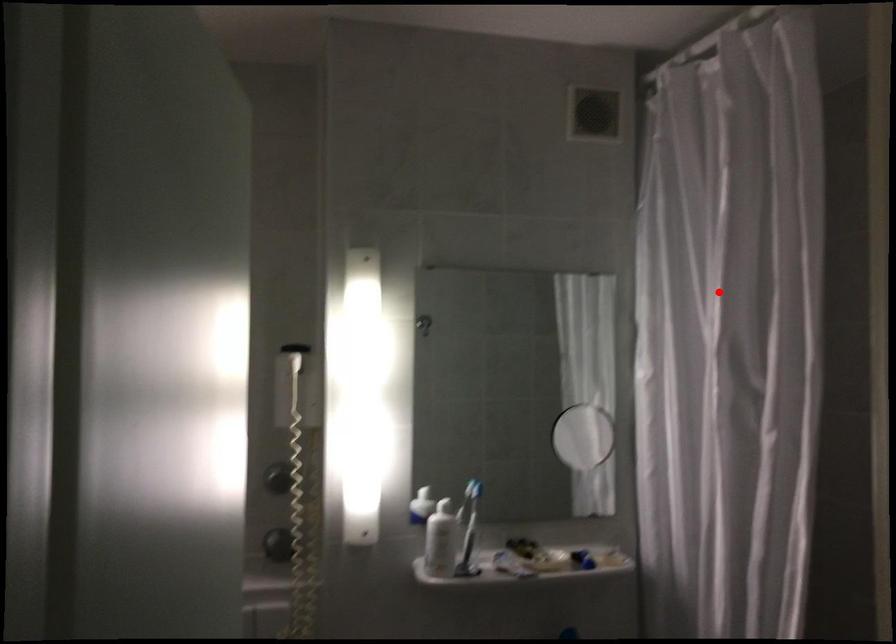
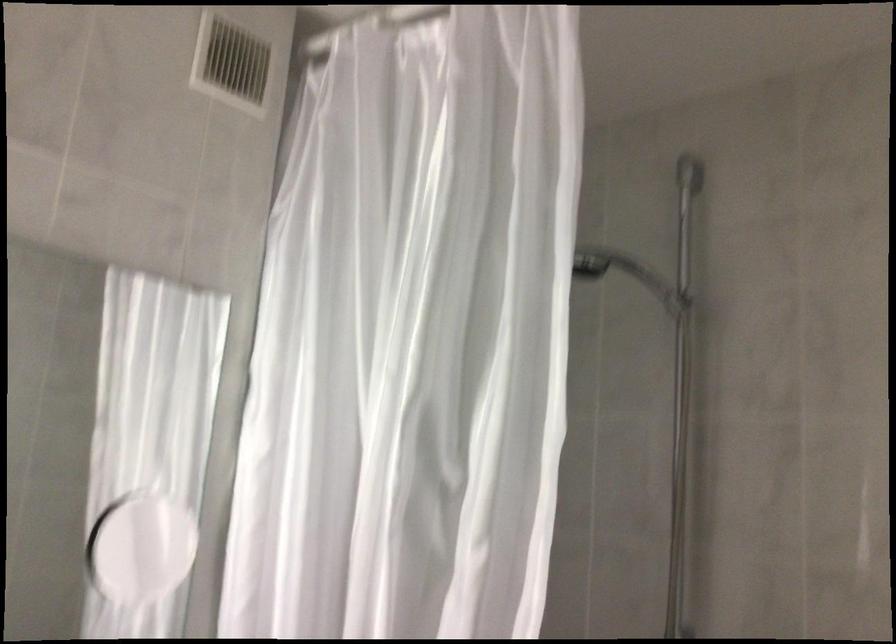
Question: I am providing you with two images of the same scene from different viewpoints. A red point is shown in image1. For the corresponding object point in image2, is it positioned nearer or farther from the camera?

Choices:
 (A) Nearer
 (B) Farther

Answer: (A)